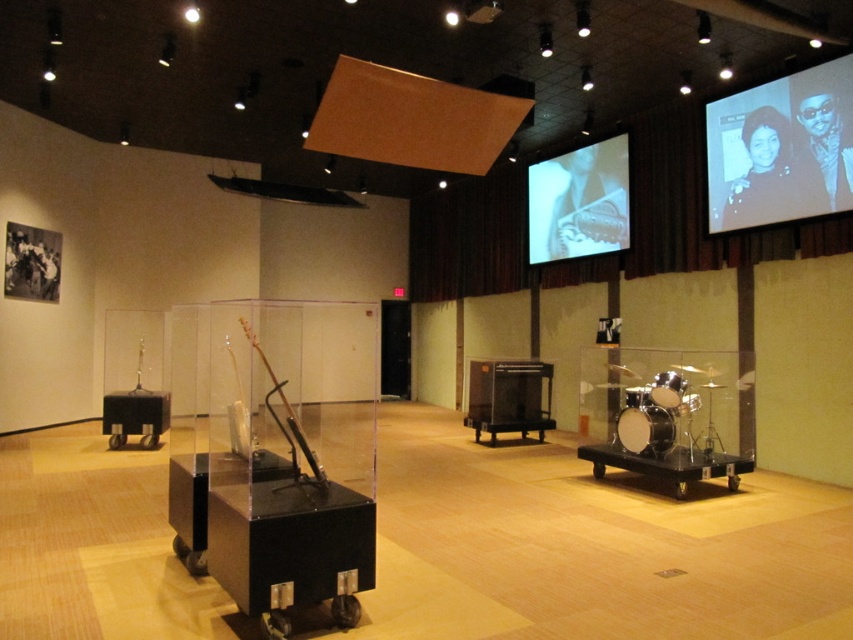
Question: Does black glossy projection screen at upper right have a greater width compared to white matte projection screen at upper right?

Choices:
 (A) no
 (B) yes

Answer: (A)

Question: Is black glossy projection screen at upper right below white matte projection screen at upper right?

Choices:
 (A) no
 (B) yes

Answer: (A)

Question: Is black glossy projection screen at upper right above white matte projection screen at upper right?

Choices:
 (A) no
 (B) yes

Answer: (B)

Question: Which point is farther to the camera?

Choices:
 (A) black glossy projection screen at upper right
 (B) white matte projection screen at upper right

Answer: (B)

Question: Among these points, which one is farthest from the camera?

Choices:
 (A) (821, 84)
 (B) (624, 154)

Answer: (B)